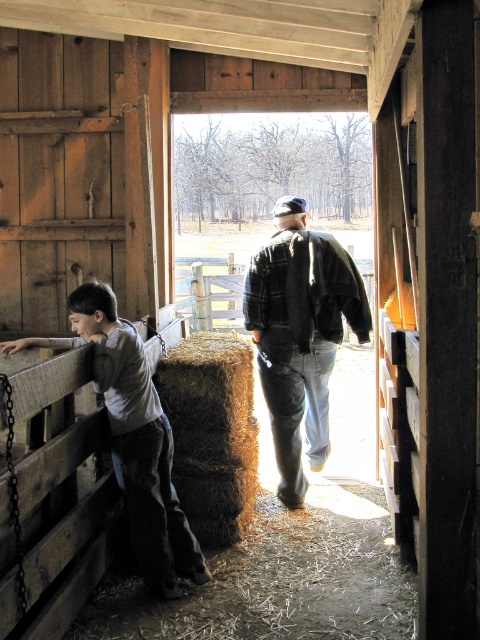
Question: Estimate the real-world distances between objects in this image. Which object is closer to the light brown wooden fence at left?

Choices:
 (A) brown rough hay at center
 (B) flannel jacket at center

Answer: (A)

Question: Which object is closer to the camera taking this photo?

Choices:
 (A) brown rough hay at center
 (B) light brown wooden fence at left
 (C) flannel jacket at center

Answer: (B)

Question: Can you confirm if flannel jacket at center is positioned above light brown wooden fence at left?

Choices:
 (A) no
 (B) yes

Answer: (B)

Question: Considering the relative positions of flannel jacket at center and brown rough hay at center in the image provided, where is flannel jacket at center located with respect to brown rough hay at center?

Choices:
 (A) below
 (B) above

Answer: (B)

Question: Does flannel jacket at center appear on the left side of brown rough hay at center?

Choices:
 (A) yes
 (B) no

Answer: (B)

Question: Which of these objects is positioned closest to the flannel jacket at center?

Choices:
 (A) light brown wooden fence at left
 (B) brown rough hay at center

Answer: (B)